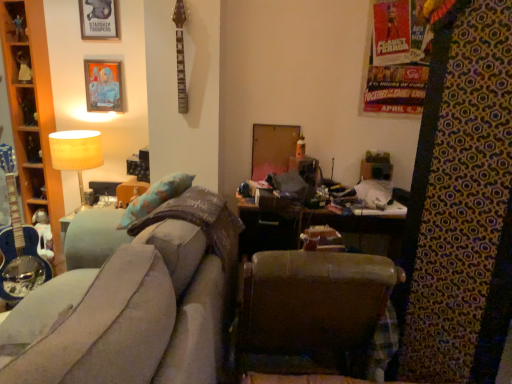
At what (x,y) coordinates should I click in order to perform the action: click on metallic silver picture frame at upper left, marked as the 1th picture frame in a bottom-to-top arrangement. Please return your answer as a coordinate pair (x, y). The height and width of the screenshot is (384, 512). Looking at the image, I should click on point(103,86).

Describe the element at coordinates (103, 86) in the screenshot. I see `metallic silver picture frame at upper left, marked as the second picture frame in a top-to-bottom arrangement` at that location.

I want to click on velvet grey couch at center, so click(x=124, y=318).

Is brown leather chair at center far from wooden cabinet at left?

Yes, brown leather chair at center and wooden cabinet at left are quite far apart.

Does brown leather chair at center have a larger size compared to wooden cabinet at left?

Yes, brown leather chair at center is bigger than wooden cabinet at left.

From a real-world perspective, is brown leather chair at center beneath wooden cabinet at left?

Yes, from a real-world perspective, brown leather chair at center is below wooden cabinet at left.

How much distance is there between brown leather chair at center and wooden cabinet at left?

They are 6.87 feet apart.

From a real-world perspective, is wooden cabinet at left on velvet grey couch at center?

Yes.

Is wooden cabinet at left surrounding velvet grey couch at center?

No, velvet grey couch at center is located outside of wooden cabinet at left.

The height and width of the screenshot is (384, 512). I want to click on studio couch on the right side of wooden cabinet at left, so click(124, 318).

Which is more distant, (51, 205) or (105, 333)?

The point (51, 205) is more distant.

Is metallic silver picture frame at upper left, marked as the 1th picture frame in a bottom-to-top arrangement, next to brown leather chair at center?

No.

Is metallic silver picture frame at upper left, marked as the second picture frame in a top-to-bottom arrangement, oriented away from brown leather chair at center?

No, metallic silver picture frame at upper left, marked as the second picture frame in a top-to-bottom arrangement, is not facing the opposite direction of brown leather chair at center.

How different are the orientations of metallic silver picture frame at upper left, marked as the second picture frame in a top-to-bottom arrangement, and brown leather chair at center in degrees?

The angular difference between metallic silver picture frame at upper left, marked as the second picture frame in a top-to-bottom arrangement, and brown leather chair at center is 173 degrees.

Which object is positioned more to the left, metallic silver picture frame at upper left, marked as the second picture frame in a top-to-bottom arrangement, or brown leather chair at center?

From the viewer's perspective, metallic silver picture frame at upper left, marked as the second picture frame in a top-to-bottom arrangement, appears more on the left side.

Is brown leather chair at center taller or shorter than metallic silver picture frame at upper left, the 2th picture frame when ordered from bottom to top?

Clearly, brown leather chair at center is taller compared to metallic silver picture frame at upper left, the 2th picture frame when ordered from bottom to top.

Which of these two, brown leather chair at center or metallic silver picture frame at upper left, the first picture frame from the top, is thinner?

With smaller width is metallic silver picture frame at upper left, the first picture frame from the top.

In the scene shown: From the image's perspective, would you say brown leather chair at center is positioned over metallic silver picture frame at upper left, the 2th picture frame when ordered from bottom to top?

No, from the image's perspective, brown leather chair at center is not above metallic silver picture frame at upper left, the 2th picture frame when ordered from bottom to top.

Is the surface of brown leather chair at center in direct contact with metallic silver picture frame at upper left, the first picture frame from the top?

No, brown leather chair at center is not next to metallic silver picture frame at upper left, the first picture frame from the top.

From the image's perspective, which is above, wooden cabinet at left or matte beige lampshade at upper left?

wooden cabinet at left.

Is wooden cabinet at left oriented away from matte beige lampshade at upper left?

No, wooden cabinet at left is not facing the opposite direction of matte beige lampshade at upper left.

Does brown leather chair at center turn towards matte beige lampshade at upper left?

No, brown leather chair at center is not oriented towards matte beige lampshade at upper left.

Is brown leather chair at center spatially inside matte beige lampshade at upper left, or outside of it?

brown leather chair at center is not enclosed by matte beige lampshade at upper left.

Considering the relative positions of brown leather chair at center and matte beige lampshade at upper left in the image provided, is brown leather chair at center to the right of matte beige lampshade at upper left from the viewer's perspective?

Correct, you'll find brown leather chair at center to the right of matte beige lampshade at upper left.

Is brown leather chair at center placed right next to velvet grey couch at center?

brown leather chair at center is not next to velvet grey couch at center, and they're not touching.

Which object is further away from the camera, brown leather chair at center or velvet grey couch at center?

brown leather chair at center is behind.

From a real-world perspective, does brown leather chair at center stand above velvet grey couch at center?

No, from a real-world perspective, brown leather chair at center is not over velvet grey couch at center

Can you confirm if brown leather chair at center is positioned to the right of velvet grey couch at center?

Yes.

I want to click on chair located below the wooden cabinet at left (from the image's perspective), so click(x=316, y=313).

In the image, there is a velvet grey couch at center. Identify the location of cabinet above it (from the image's perspective). 32,111.

Which object lies nearer to the anchor point wooden cabinet at left, metallic silver picture frame at upper left, marked as the second picture frame in a top-to-bottom arrangement, or velvet grey couch at center?

Among the two, metallic silver picture frame at upper left, marked as the second picture frame in a top-to-bottom arrangement, is located nearer to wooden cabinet at left.

Considering their positions, is brown leather chair at center positioned further to wooden cabinet at left than matte beige lampshade at upper left?

Based on the image, brown leather chair at center appears to be further to wooden cabinet at left.

Estimate the real-world distances between objects in this image. Which object is further from velvet grey couch at center, metallic silver picture frame at upper left, the first picture frame from the top, or wooden cabinet at left?

Among the two, metallic silver picture frame at upper left, the first picture frame from the top, is located further to velvet grey couch at center.

Looking at this image, from the image, which object appears to be nearer to wooden cabinet at left, matte beige lampshade at upper left or brown leather chair at center?

matte beige lampshade at upper left lies closer to wooden cabinet at left than the other object.

Based on their spatial positions, is matte beige lampshade at upper left or metallic silver picture frame at upper left, the first picture frame from the top, closer to velvet grey couch at center?

matte beige lampshade at upper left lies closer to velvet grey couch at center than the other object.

Which object lies nearer to the anchor point metallic silver picture frame at upper left, marked as the 1th picture frame in a bottom-to-top arrangement, brown leather chair at center or matte beige lampshade at upper left?

matte beige lampshade at upper left is closer to metallic silver picture frame at upper left, marked as the 1th picture frame in a bottom-to-top arrangement.

When comparing their distances from brown leather chair at center, does metallic silver picture frame at upper left, the 2th picture frame when ordered from bottom to top, or matte beige lampshade at upper left seem closer?

The object closer to brown leather chair at center is matte beige lampshade at upper left.

When comparing their distances from metallic silver picture frame at upper left, the 2th picture frame when ordered from bottom to top, does brown leather chair at center or velvet grey couch at center seem further?

brown leather chair at center is further to metallic silver picture frame at upper left, the 2th picture frame when ordered from bottom to top.

Where is `cabinet between metallic silver picture frame at upper left, the first picture frame from the top, and matte beige lampshade at upper left from top to bottom`? This screenshot has height=384, width=512. cabinet between metallic silver picture frame at upper left, the first picture frame from the top, and matte beige lampshade at upper left from top to bottom is located at coordinates (32, 111).

This screenshot has height=384, width=512. I want to click on cabinet located between velvet grey couch at center and metallic silver picture frame at upper left, marked as the 1th picture frame in a bottom-to-top arrangement, in the depth direction, so click(32, 111).

This screenshot has width=512, height=384. Identify the location of table lamp that lies between metallic silver picture frame at upper left, the first picture frame from the top, and brown leather chair at center from top to bottom. (76, 153).

Where is `chair between velvet grey couch at center and metallic silver picture frame at upper left, marked as the second picture frame in a top-to-bottom arrangement, from front to back`? The width and height of the screenshot is (512, 384). chair between velvet grey couch at center and metallic silver picture frame at upper left, marked as the second picture frame in a top-to-bottom arrangement, from front to back is located at coordinates (316, 313).